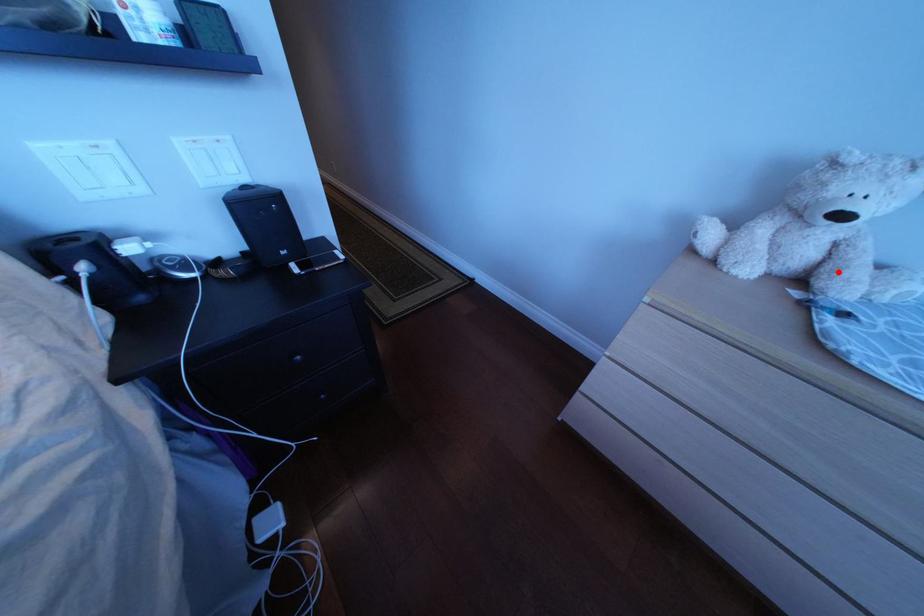
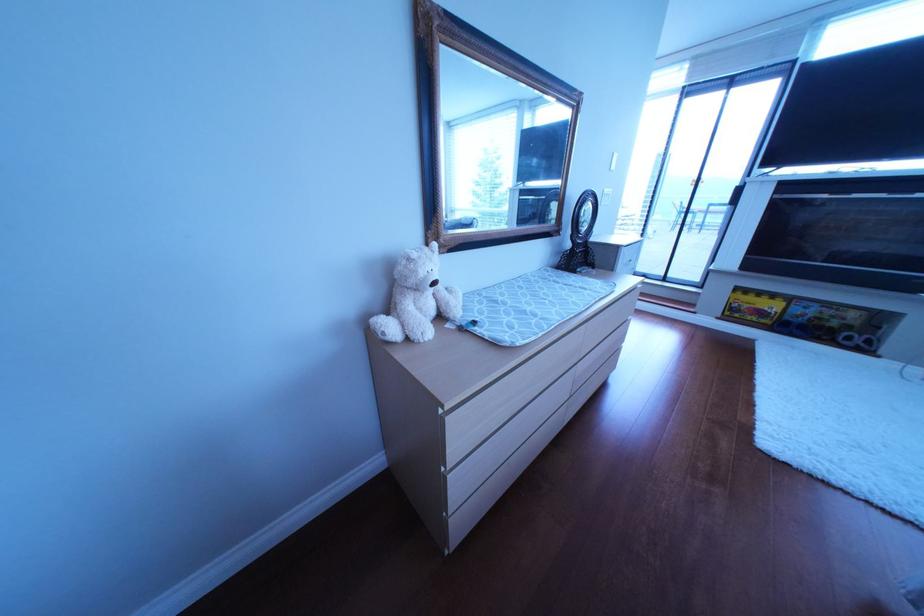
Where in the second image is the point corresponding to the highlighted location from the first image?

(458, 310)